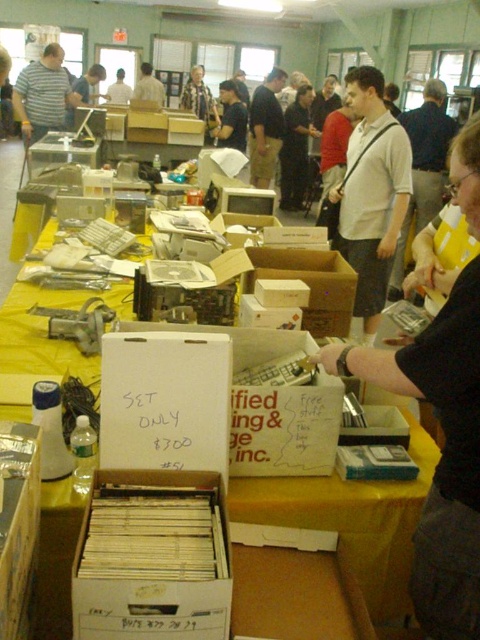
Question: Which object is the farthest from the yellow cardboard box at lower left?

Choices:
 (A) matte black shirt at center
 (B) yellow fabric table at center
 (C) brown cardboard box at center
 (D) light brown shirt at center

Answer: (D)

Question: Can you confirm if yellow fabric table at center is wider than matte black shirt at center?

Choices:
 (A) no
 (B) yes

Answer: (A)

Question: Does brown cardboard box at center have a smaller size compared to matte black shirt at center?

Choices:
 (A) yes
 (B) no

Answer: (A)

Question: Can you confirm if brown cardboard box at center is positioned to the left of light brown shirt at center?

Choices:
 (A) no
 (B) yes

Answer: (A)

Question: Which of the following is the closest to the observer?

Choices:
 (A) brown cardboard box at center
 (B) yellow cardboard box at lower left

Answer: (B)

Question: Which object appears closest to the camera in this image?

Choices:
 (A) matte black shirt at center
 (B) yellow cardboard box at lower left
 (C) light brown shirt at center
 (D) brown cardboard box at center

Answer: (B)